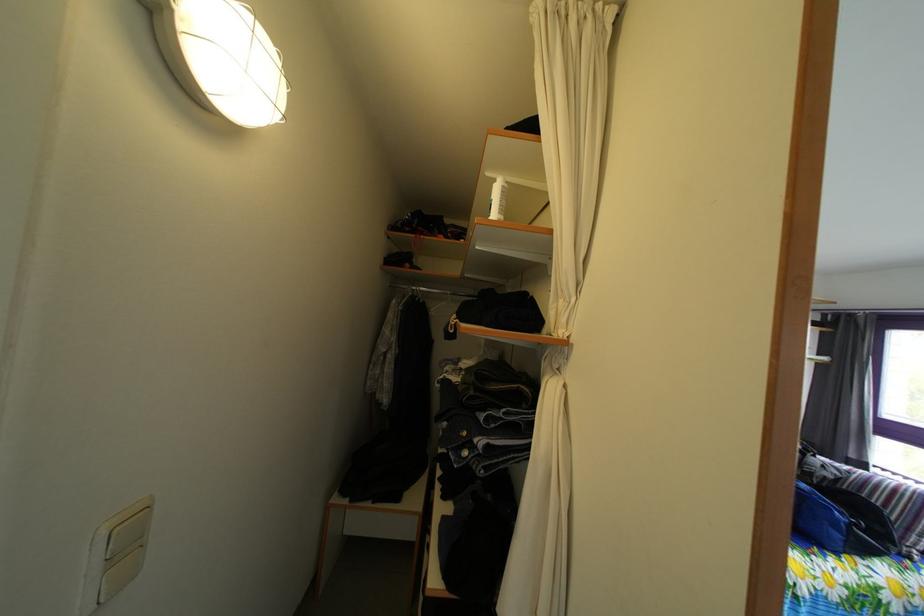
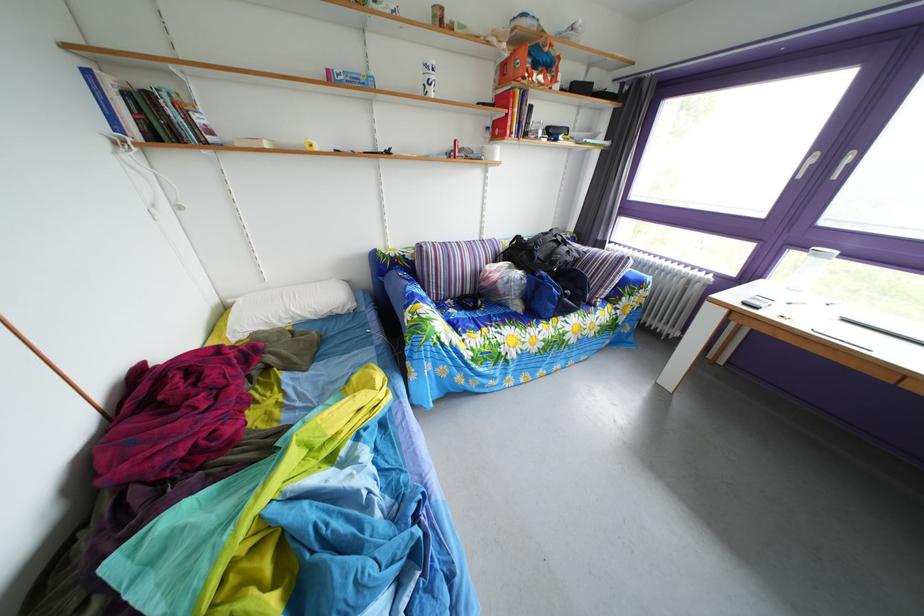
In the second image, find the point that corresponds to (815,493) in the first image.

(553, 282)